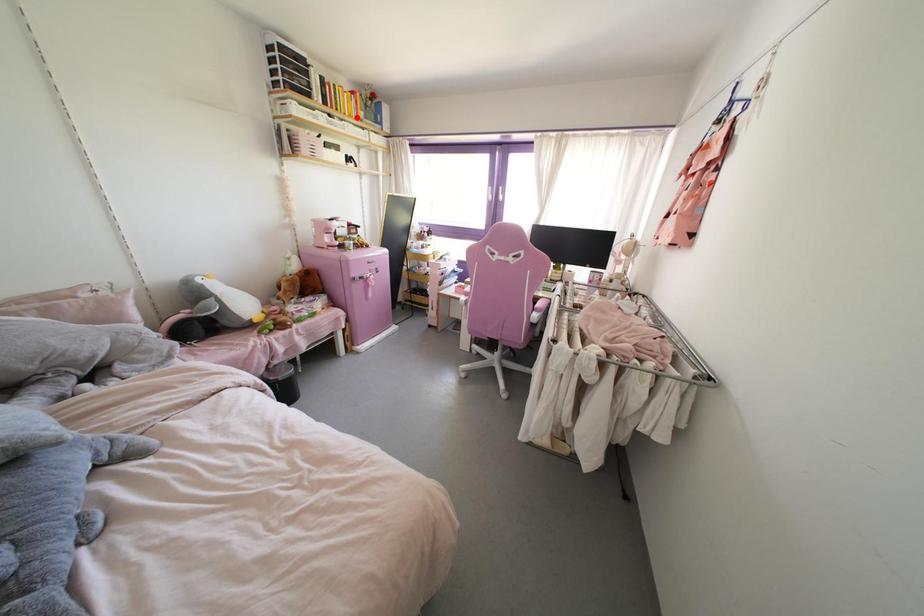
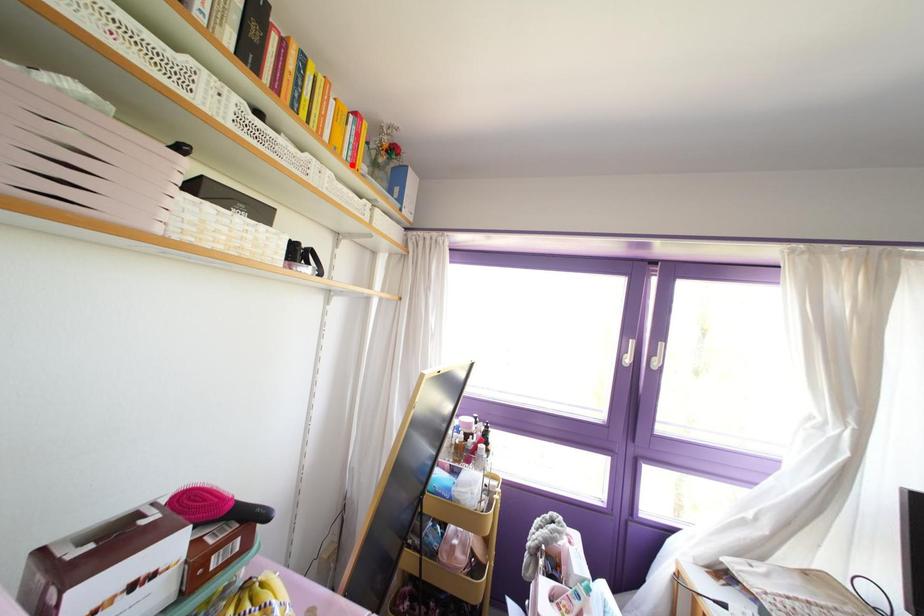
I am providing you with two images of the same scene from different viewpoints. A red point is marked on the first image and another point is marked on the second image. Is the red point in image1 aligned with the point shown in image2?

Yes